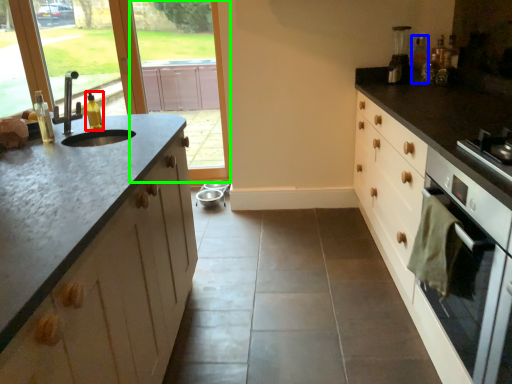
Question: Which is nearer to the bottle (highlighted by a red box)? bottle (highlighted by a blue box) or window screen (highlighted by a green box).

Choices:
 (A) bottle
 (B) window screen

Answer: (A)